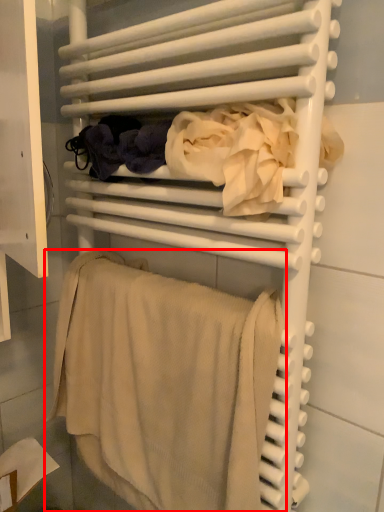
Question: In this image, where is towel (annotated by the red box) located relative to clothing?

Choices:
 (A) left
 (B) right

Answer: (A)